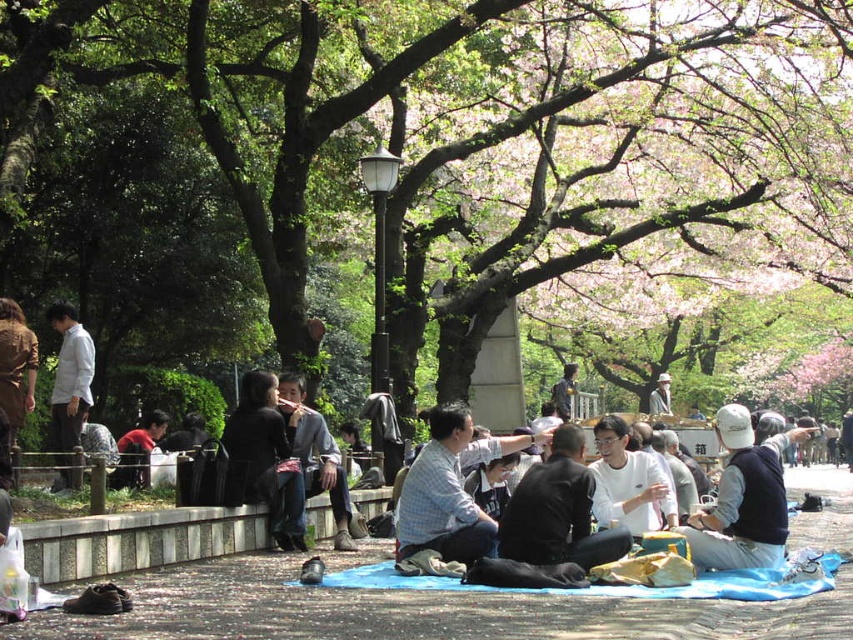
Question: Estimate the real-world distances between objects in this image. Which object is farther from the red shirt at lower left?

Choices:
 (A) dark gray sweater at center
 (B) light brown fabric hat at center
 (C) white matte shirt at center
 (D) black leather jacket at center

Answer: (B)

Question: Is white cap at center positioned in front of red shirt at lower left?

Choices:
 (A) no
 (B) yes

Answer: (B)

Question: Which point appears farthest from the camera in this image?

Choices:
 (A) (152, 440)
 (B) (764, 534)

Answer: (A)

Question: Which object is farther from the camera taking this photo?

Choices:
 (A) white matte shirt at center
 (B) light gray fabric at center

Answer: (A)

Question: Is green leafy tree at center thinner than white matte shirt at center?

Choices:
 (A) yes
 (B) no

Answer: (B)

Question: Can you confirm if red shirt at lower left is positioned to the left of light brown fabric hat at center?

Choices:
 (A) no
 (B) yes

Answer: (B)